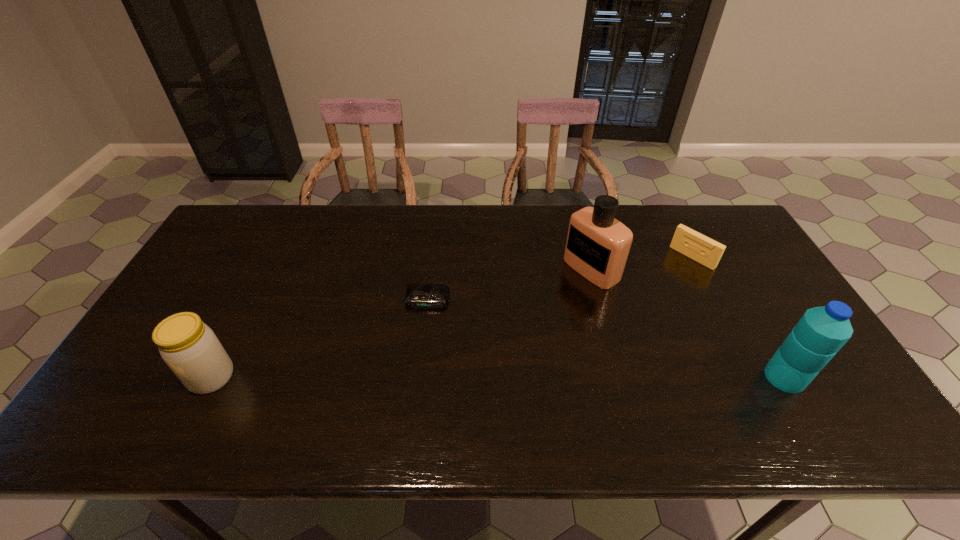
The image size is (960, 540). In order to click on vacant spot on the desktop that is between the leftmost object and the water bottle and is positioned on the display of the shortest object in this screenshot , I will do `click(415, 377)`.

Locate an element on the screen. vacant space on the desktop that is between the third shortest object and the water bottle and is positioned on the front label of the third object from left to right is located at coordinates (414, 377).

Identify the location of free space on the desktop that is between the third tallest object and the water bottle and is positioned at the front of the fourth tallest object with spools. tap(551, 377).